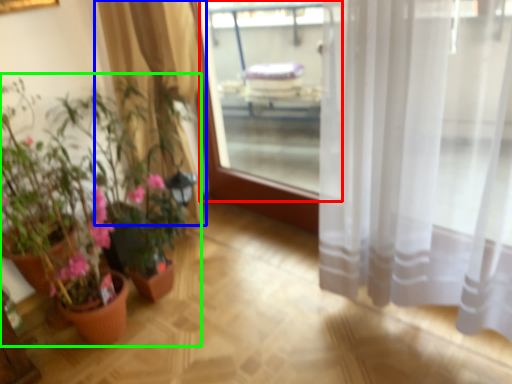
Question: Which object is the farthest from window screen (highlighted by a red box)? Choose among these: curtain (highlighted by a blue box) or houseplant (highlighted by a green box).

Choices:
 (A) curtain
 (B) houseplant

Answer: (B)